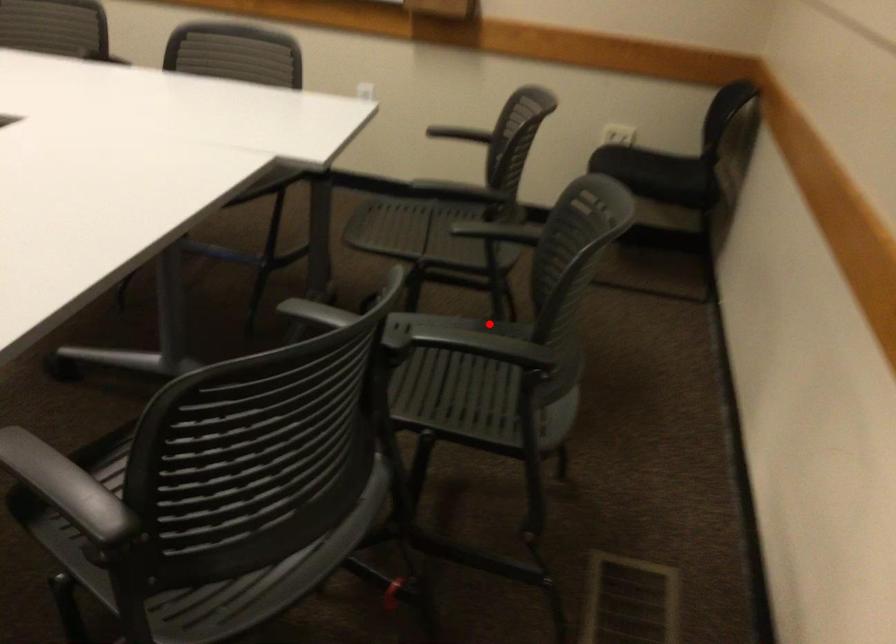
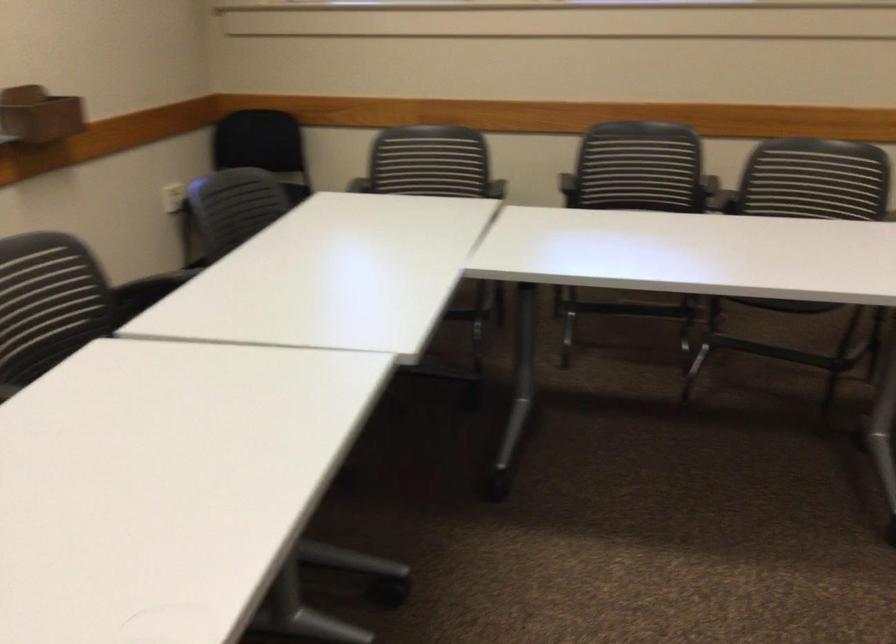
Question: I am providing you with two images of the same scene from different viewpoints. A red point is marked on the first image. Is the red point's position out of view in image 2?

Choices:
 (A) Yes
 (B) No

Answer: (A)